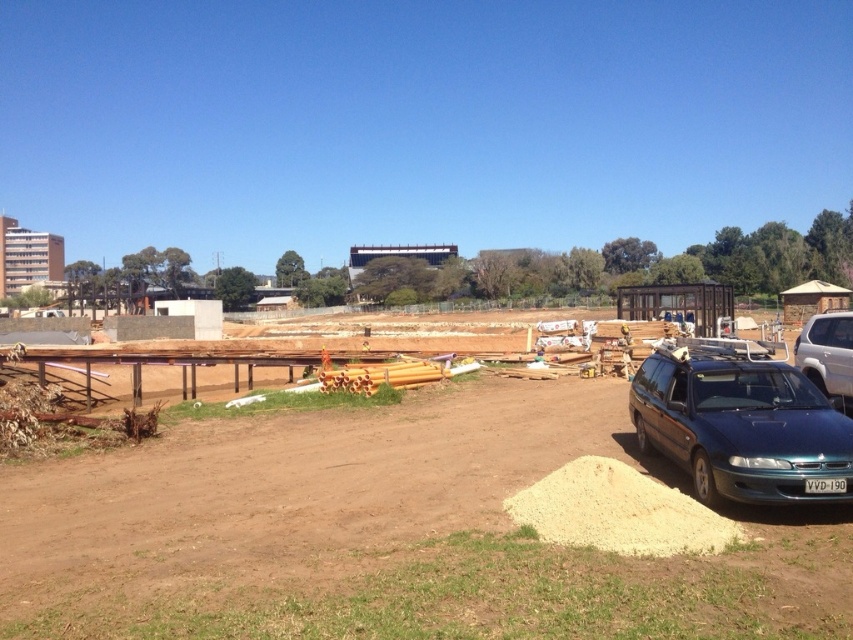
Question: Does light brown gravel at lower right appear under satin white suv at right?

Choices:
 (A) yes
 (B) no

Answer: (A)

Question: Among these objects, which one is farthest from the camera?

Choices:
 (A) light brown gravel at lower right
 (B) metallic blue station wagon at lower right
 (C) white plastic license plate at lower right

Answer: (B)

Question: Which point is closer to the camera?

Choices:
 (A) satin white suv at right
 (B) metallic blue station wagon at lower right
 (C) white plastic license plate at lower right
 (D) light brown gravel at lower right

Answer: (D)

Question: Can you confirm if light brown gravel at lower right is thinner than white plastic license plate at lower right?

Choices:
 (A) yes
 (B) no

Answer: (B)

Question: Among these objects, which one is farthest from the camera?

Choices:
 (A) satin white suv at right
 (B) light brown gravel at lower right

Answer: (A)

Question: Can you confirm if metallic blue station wagon at lower right is positioned to the right of satin white suv at right?

Choices:
 (A) yes
 (B) no

Answer: (B)